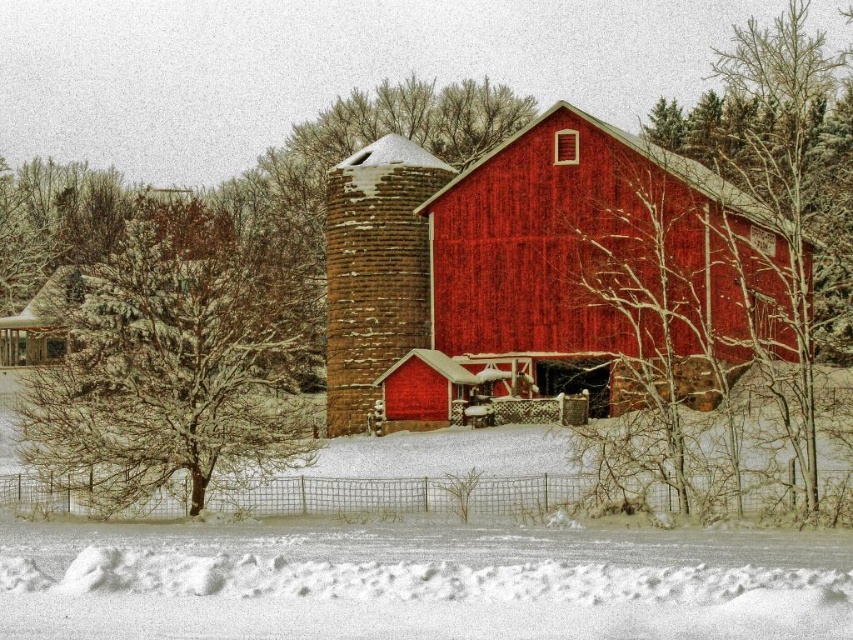
Is snow-covered branches at left bigger than bare branches at center?

Yes, snow-covered branches at left is bigger than bare branches at center.

Who is lower down, snow-covered branches at left or bare branches at center?

snow-covered branches at left is below.

You are a GUI agent. You are given a task and a screenshot of the screen. Output one action in this format:
    pyautogui.click(x=<x>, y=<y>)
    Task: Click on the snow-covered branches at left
    The height and width of the screenshot is (640, 853).
    Given the screenshot: What is the action you would take?
    pyautogui.click(x=167, y=368)

Does smooth wooden barn at center appear on the left side of bare branches at center?

Yes, smooth wooden barn at center is to the left of bare branches at center.

Which of these two, smooth wooden barn at center or bare branches at center, stands taller?

smooth wooden barn at center

The image size is (853, 640). Identify the location of smooth wooden barn at center. (508, 248).

Is smooth wooden barn at center wider than snow-covered branches at left?

Yes, smooth wooden barn at center is wider than snow-covered branches at left.

Who is more forward, (343,337) or (160,262)?

Point (343,337)

Identify the location of smooth wooden barn at center. (508, 248).